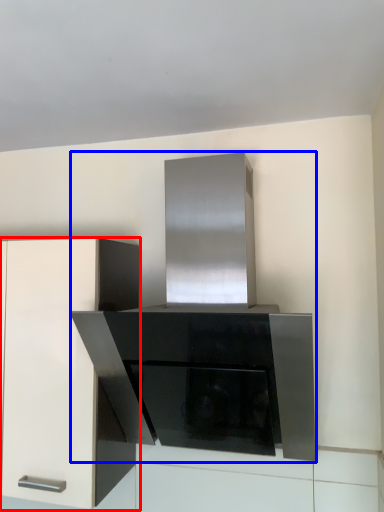
Question: Among these objects, which one is farthest to the camera, cabinetry (highlighted by a red box) or appliance (highlighted by a blue box)?

Choices:
 (A) cabinetry
 (B) appliance

Answer: (A)